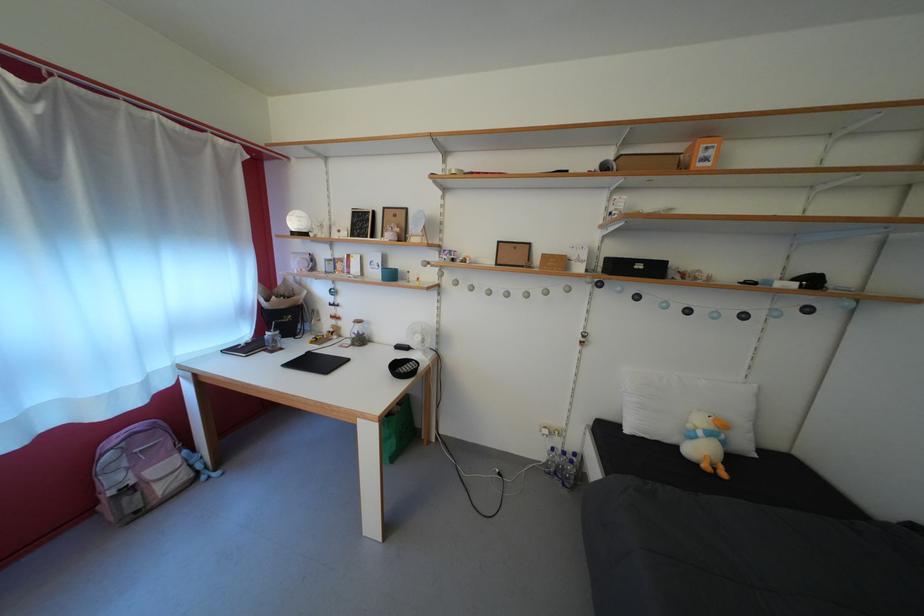
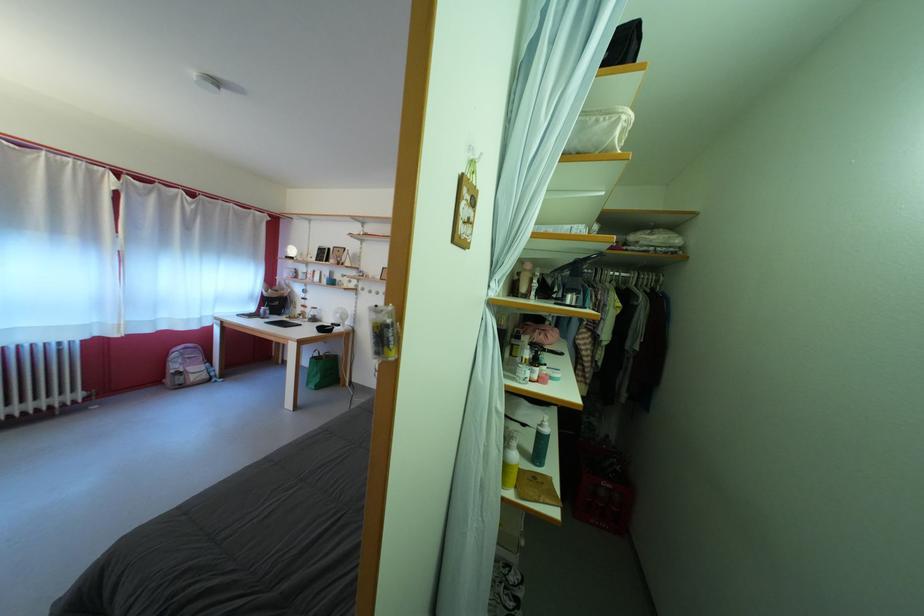
Where in the second image is the point corresponding to point (370, 346) from the first image?

(322, 325)